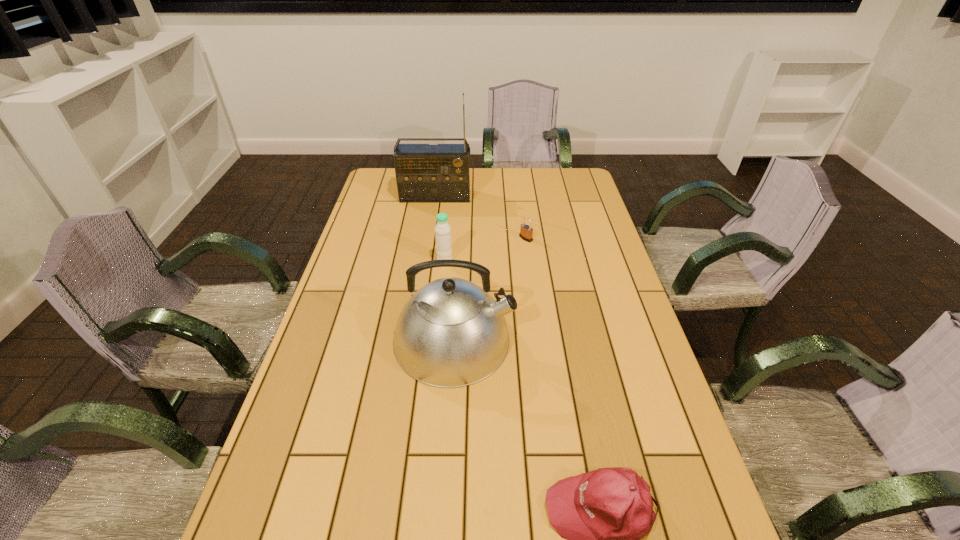
Find the location of a particular element. vacant space located on the back of the padlock is located at coordinates (521, 200).

This screenshot has height=540, width=960. I want to click on object that is positioned at the far edge, so click(x=425, y=173).

Identify the location of object that is positioned at the left edge. (425, 173).

Where is `object present at the far left corner`? The height and width of the screenshot is (540, 960). object present at the far left corner is located at coordinates (425, 173).

In the image, there is a desktop. Where is `free space at the far edge`? The image size is (960, 540). free space at the far edge is located at coordinates (515, 183).

Find the location of `free space at the left edge of the desktop`. free space at the left edge of the desktop is located at coordinates (337, 348).

Where is `vacant space at the right edge`? This screenshot has height=540, width=960. vacant space at the right edge is located at coordinates (679, 497).

At what (x,y) coordinates should I click in order to perform the action: click on vacant space at the far right corner of the desktop. Please return your answer as a coordinate pair (x, y). Image resolution: width=960 pixels, height=540 pixels. Looking at the image, I should click on (563, 184).

The height and width of the screenshot is (540, 960). I want to click on free space between the fourth shortest object and the radio receiver, so click(x=445, y=268).

Locate an element on the screen. This screenshot has width=960, height=540. the third closest object relative to the water bottle is located at coordinates (425, 173).